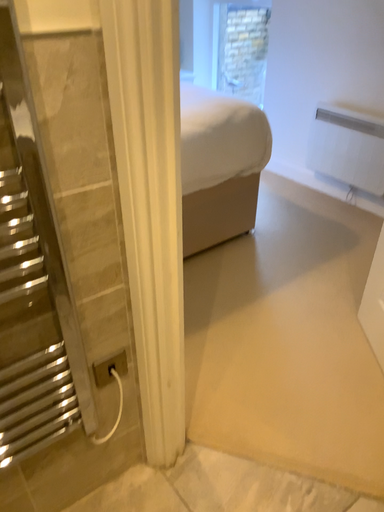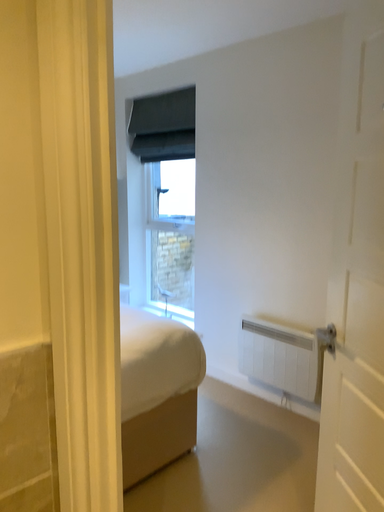
Question: How did the camera likely rotate when shooting the video?

Choices:
 (A) rotated right
 (B) rotated left

Answer: (A)